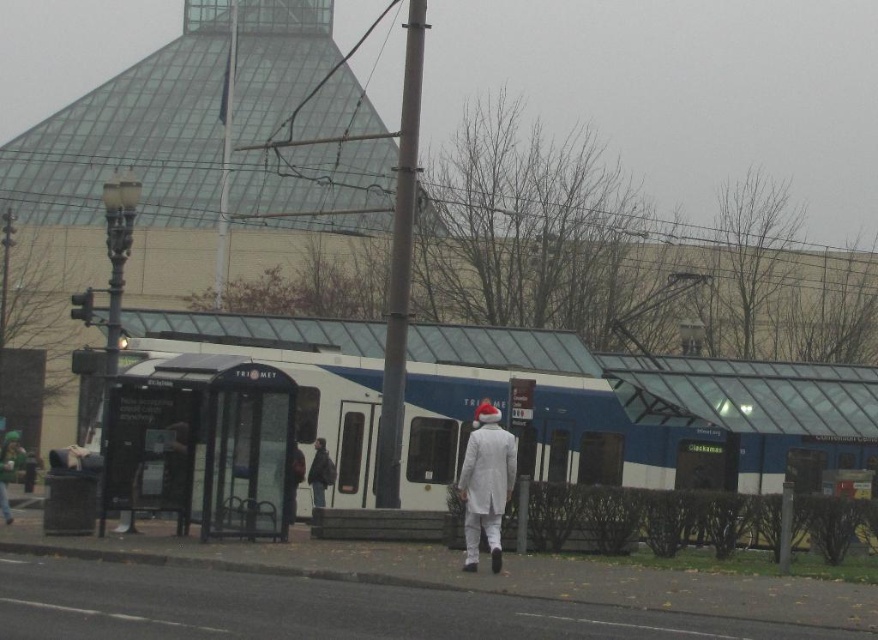
Question: Estimate the real-world distances between objects in this image. Which object is closer to the white glossy train at center?

Choices:
 (A) transparent glass bus stop at center
 (B) dark gray fabric jacket at center

Answer: (B)

Question: Is white matte coat at center to the right of dark gray fabric jacket at center from the viewer's perspective?

Choices:
 (A) yes
 (B) no

Answer: (A)

Question: Considering the real-world distances, which object is farthest from the white glossy train at center?

Choices:
 (A) dark gray fabric jacket at center
 (B) transparent glass bus stop at center

Answer: (B)

Question: Can you confirm if white matte coat at center is thinner than dark gray fabric jacket at center?

Choices:
 (A) no
 (B) yes

Answer: (A)

Question: Which point is farther from the camera taking this photo?

Choices:
 (A) (483, 513)
 (B) (180, 403)
 (C) (330, 465)
 (D) (572, 467)

Answer: (D)

Question: Does transparent glass bus stop at center appear on the right side of dark gray fabric jacket at center?

Choices:
 (A) yes
 (B) no

Answer: (B)